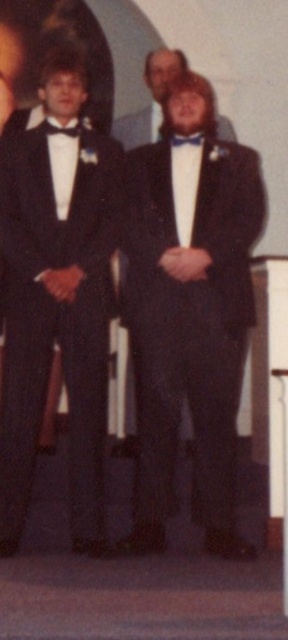
You are a photographer at a formal event. You need to position a spotlight exactly at the location of the matte black tuxedo at left. What are the coordinates where you should place the spotlight?

The coordinates for the matte black tuxedo at left are at point (57, 292), so you should place the spotlight there.

You are standing at the point marked as point [103,266] in the image. You want to move to the stage where the two men in tuxedos are standing. Can you walk directly to the stage without moving past the two men?

The distance between you and the stage is 14.34 feet, so you can walk directly to the stage without needing to move past the two men.